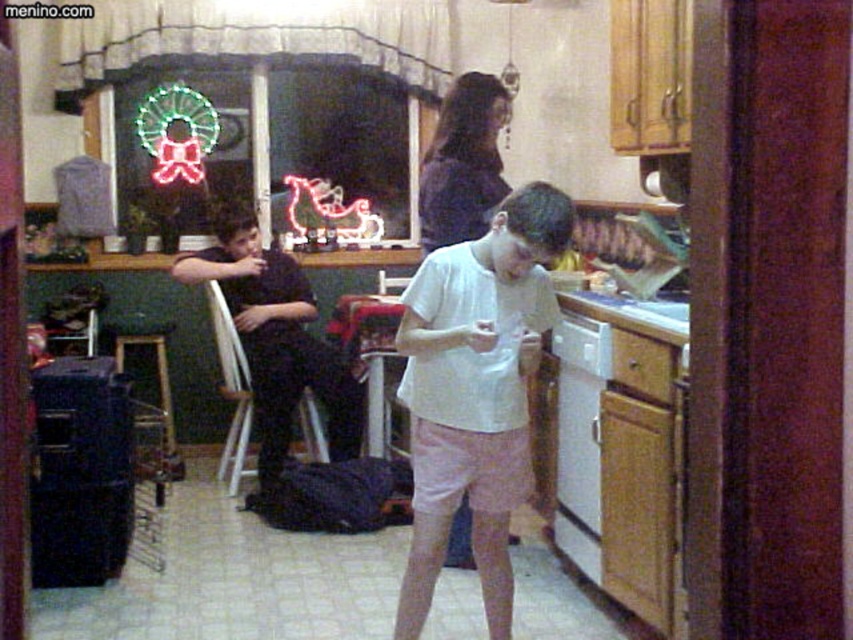
Is point (270, 362) behind point (596, 467)?

Yes, point (270, 362) is farther from viewer.

The height and width of the screenshot is (640, 853). What do you see at coordinates (276, 339) in the screenshot?
I see `black cotton shirt at left` at bounding box center [276, 339].

This screenshot has width=853, height=640. What are the coordinates of `black cotton shirt at left` in the screenshot? It's located at (276, 339).

Based on the photo, between white cotton shirt at center and white plastic dishwasher at lower center, which one has less height?

Standing shorter between the two is white plastic dishwasher at lower center.

What do you see at coordinates (474, 392) in the screenshot?
I see `white cotton shirt at center` at bounding box center [474, 392].

Is point (451, 349) farther from camera compared to point (558, 499)?

No, it is in front of (558, 499).

Where is `white cotton shirt at center`? The height and width of the screenshot is (640, 853). white cotton shirt at center is located at coordinates (x=474, y=392).

Between white cotton shirt at center and black cotton shirt at left, which one is positioned lower?

white cotton shirt at center is below.

Is white cotton shirt at center above black cotton shirt at left?

Incorrect, white cotton shirt at center is not positioned above black cotton shirt at left.

Which is in front, point (460, 396) or point (277, 266)?

Point (460, 396) is in front.

Locate an element on the screen. Image resolution: width=853 pixels, height=640 pixels. white cotton shirt at center is located at coordinates (474, 392).